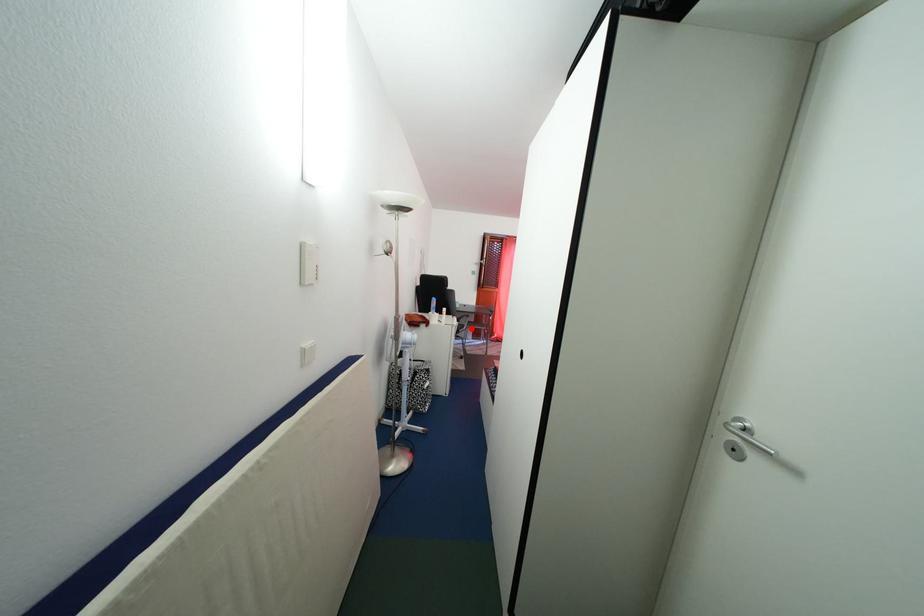
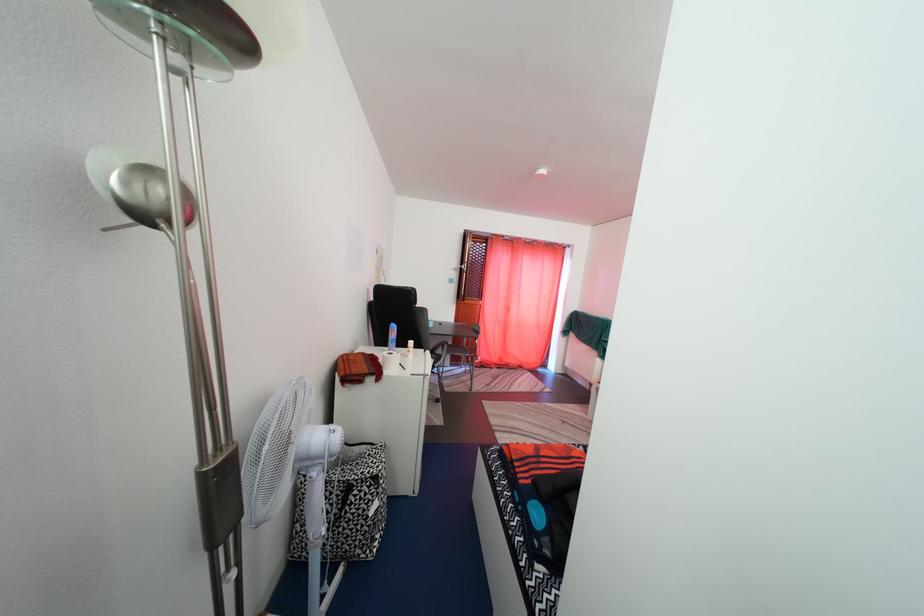
Question: I am providing you with two images of the same scene from different viewpoints. A red point is marked on the first image. Can you still see the location of the red point in image 2?

Choices:
 (A) Yes
 (B) No

Answer: (A)